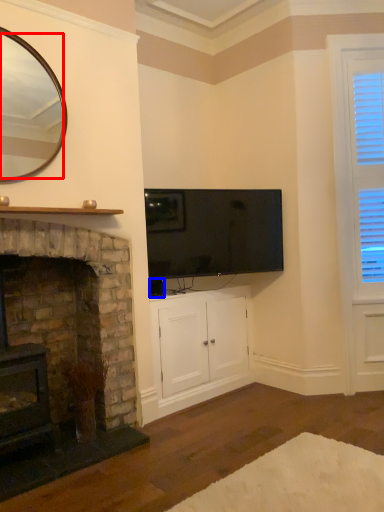
Question: Which object appears farthest to the camera in this image, mirror (highlighted by a red box) or corded phone (highlighted by a blue box)?

Choices:
 (A) mirror
 (B) corded phone

Answer: (B)